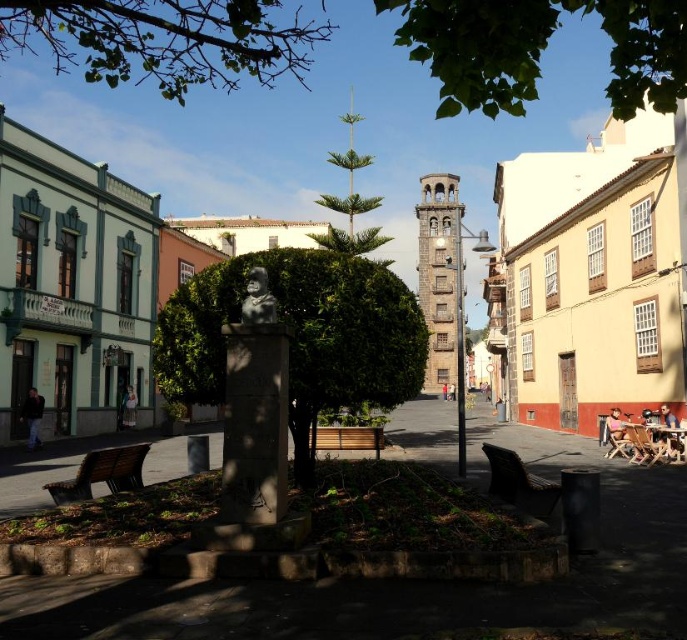
Looking at this image, you are a traveler who wants to sit down and rest. You see a wooden bench at center and a blue denim jacket at left. Which one can you sit on?

The wooden bench at center can be sat on, while the blue denim jacket at left is likely an item of clothing and not meant for sitting.

You are standing in the plaza and see the pink fabric chair at lower right and the dark blue jeans at lower left. Which object is closer to you?

The pink fabric chair at lower right is closer to you because it is in front of the dark blue jeans at lower left.